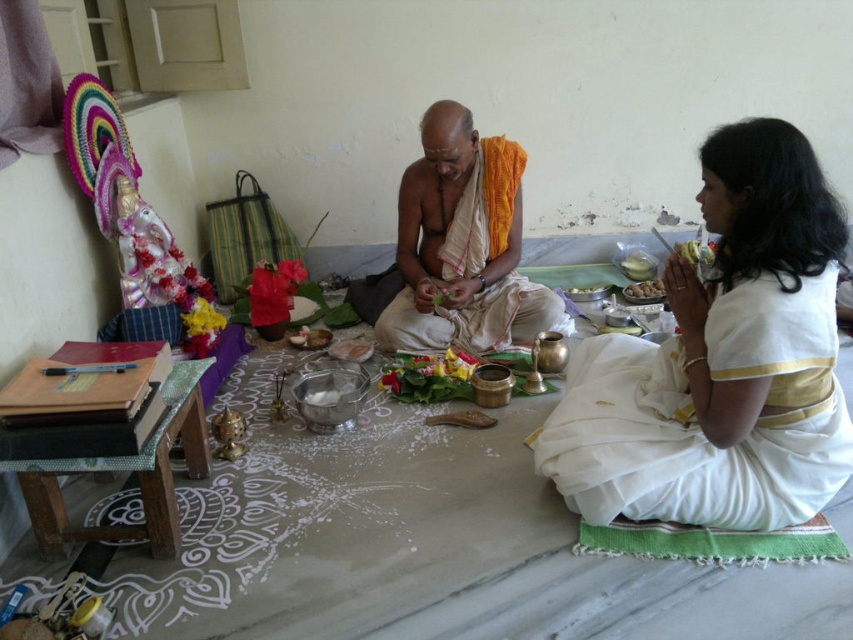
You are a guest at this ceremony and need to place a small offering on the smooth golden plate at center and the matte brown bowl at center. Which object requires a smaller area to place the offering?

The smooth golden plate at center requires a smaller area because its width is less than the matte brown bowl at center.